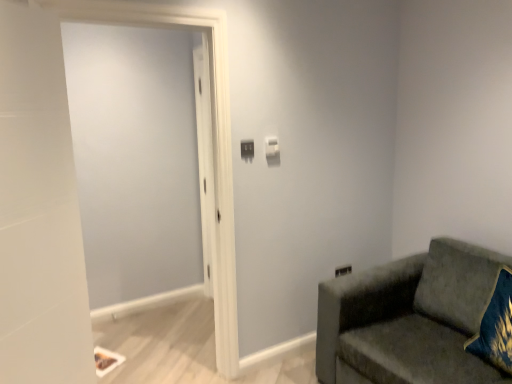
Locate an element on the screen. This screenshot has height=384, width=512. velvet green couch at right is located at coordinates (410, 317).

The height and width of the screenshot is (384, 512). What do you see at coordinates (247, 148) in the screenshot?
I see `matte plastic light switch at center, acting as the 1th light switch starting from the left` at bounding box center [247, 148].

Consider the image. What is the approximate height of velvet blue pillow at lower right?

velvet blue pillow at lower right is 21.24 inches tall.

This screenshot has height=384, width=512. Describe the element at coordinates (496, 325) in the screenshot. I see `velvet blue pillow at lower right` at that location.

Where is `velvet green couch at right`? The image size is (512, 384). velvet green couch at right is located at coordinates (410, 317).

Is white plastic light switch at upper center, the 1th light switch positioned from the back, at the back of velvet blue pillow at lower right?

No, velvet blue pillow at lower right's orientation is not away from white plastic light switch at upper center, the 1th light switch positioned from the back.

From the image's perspective, is velvet blue pillow at lower right located above or below white plastic light switch at upper center, the 2th light switch when ordered from left to right?

Clearly, from the image's perspective, velvet blue pillow at lower right is below white plastic light switch at upper center, the 2th light switch when ordered from left to right.

Looking at their sizes, would you say velvet blue pillow at lower right is wider or thinner than white plastic light switch at upper center, the 1th light switch positioned from the back?

Clearly, velvet blue pillow at lower right has more width compared to white plastic light switch at upper center, the 1th light switch positioned from the back.

Is velvet blue pillow at lower right with white plastic light switch at upper center, the 1th light switch positioned from the right?

No, velvet blue pillow at lower right is not touching white plastic light switch at upper center, the 1th light switch positioned from the right.

Considering the sizes of velvet green couch at right and velvet blue pillow at lower right in the image, is velvet green couch at right bigger or smaller than velvet blue pillow at lower right?

Considering their sizes, velvet green couch at right takes up more space than velvet blue pillow at lower right.

Is velvet green couch at right shorter than velvet blue pillow at lower right?

In fact, velvet green couch at right may be taller than velvet blue pillow at lower right.

Which is behind, velvet green couch at right or velvet blue pillow at lower right?

velvet blue pillow at lower right is further from the camera.

Is velvet green couch at right next to velvet blue pillow at lower right?

No.

Locate an element on the screen. This screenshot has width=512, height=384. light switch located behind the matte plastic light switch at center, acting as the 1th light switch starting from the left is located at coordinates (272, 147).

From a real-world perspective, is matte plastic light switch at center, which appears as the first light switch when viewed from the front, over white plastic light switch at upper center, the 2th light switch when ordered from left to right?

No, from a real-world perspective, matte plastic light switch at center, which appears as the first light switch when viewed from the front, is not above white plastic light switch at upper center, the 2th light switch when ordered from left to right.

Is matte plastic light switch at center, which ranks as the second light switch in back-to-front order, at the right side of white plastic light switch at upper center, the second light switch from the front?

No.

Considering the relative sizes of matte plastic light switch at center, acting as the 1th light switch starting from the left, and white plastic light switch at upper center, the 1th light switch positioned from the right, in the image provided, is matte plastic light switch at center, acting as the 1th light switch starting from the left, wider than white plastic light switch at upper center, the 1th light switch positioned from the right,?

In fact, matte plastic light switch at center, acting as the 1th light switch starting from the left, might be narrower than white plastic light switch at upper center, the 1th light switch positioned from the right.

Between velvet blue pillow at lower right and matte plastic light switch at center, acting as the 1th light switch starting from the left, which one has larger size?

velvet blue pillow at lower right is bigger.

How distant is velvet blue pillow at lower right from matte plastic light switch at center, arranged as the 2th light switch when viewed from the right?

1.50 meters.

From the picture: From a real-world perspective, between velvet blue pillow at lower right and matte plastic light switch at center, arranged as the 2th light switch when viewed from the right, who is vertically higher?

matte plastic light switch at center, arranged as the 2th light switch when viewed from the right.

Considering the sizes of objects velvet blue pillow at lower right and matte plastic light switch at center, arranged as the 2th light switch when viewed from the right, in the image provided, who is shorter, velvet blue pillow at lower right or matte plastic light switch at center, arranged as the 2th light switch when viewed from the right,?

matte plastic light switch at center, arranged as the 2th light switch when viewed from the right, is shorter.

Is velvet blue pillow at lower right facing away from velvet green couch at right?

Absolutely, velvet blue pillow at lower right is directed away from velvet green couch at right.

From the image's perspective, is velvet blue pillow at lower right below velvet green couch at right?

No, from the image's perspective, velvet blue pillow at lower right is not below velvet green couch at right.

Considering the relative sizes of velvet blue pillow at lower right and velvet green couch at right in the image provided, is velvet blue pillow at lower right bigger than velvet green couch at right?

No, velvet blue pillow at lower right is not bigger than velvet green couch at right.

Considering the relative sizes of matte plastic light switch at center, acting as the 1th light switch starting from the left, and velvet blue pillow at lower right in the image provided, is matte plastic light switch at center, acting as the 1th light switch starting from the left, taller than velvet blue pillow at lower right?

Incorrect, the height of matte plastic light switch at center, acting as the 1th light switch starting from the left, is not larger of that of velvet blue pillow at lower right.

Does matte plastic light switch at center, acting as the 1th light switch starting from the left, have a lesser width compared to velvet blue pillow at lower right?

Yes, matte plastic light switch at center, acting as the 1th light switch starting from the left, is thinner than velvet blue pillow at lower right.

Considering the relative positions of matte plastic light switch at center, which appears as the first light switch when viewed from the front, and velvet blue pillow at lower right in the image provided, is matte plastic light switch at center, which appears as the first light switch when viewed from the front, in front of velvet blue pillow at lower right?

No, matte plastic light switch at center, which appears as the first light switch when viewed from the front, is further to the viewer.

Is matte plastic light switch at center, which appears as the first light switch when viewed from the front, turned away from velvet blue pillow at lower right?

No, matte plastic light switch at center, which appears as the first light switch when viewed from the front, is not facing the opposite direction of velvet blue pillow at lower right.

Measure the distance between white glossy door at left and white plastic light switch at upper center, the 2th light switch when ordered from left to right.

white glossy door at left and white plastic light switch at upper center, the 2th light switch when ordered from left to right, are 24.78 inches apart.

From the image's perspective, is white glossy door at left positioned above or below white plastic light switch at upper center, the second light switch from the front?

Clearly, from the image's perspective, white glossy door at left is below white plastic light switch at upper center, the second light switch from the front.

How different are the orientations of white glossy door at left and white plastic light switch at upper center, the 1th light switch positioned from the back, in degrees?

2.01 degrees.

Which object is thinner, white glossy door at left or white plastic light switch at upper center, the 2th light switch when ordered from left to right?

Thinner between the two is white plastic light switch at upper center, the 2th light switch when ordered from left to right.

In the image, there is a white plastic light switch at upper center, the 1th light switch positioned from the right. What are the coordinates of `throw pillow below it (from a real-world perspective)` in the screenshot? It's located at (496, 325).

Find the location of a particular element. throw pillow behind the velvet green couch at right is located at coordinates (496, 325).

Estimate the real-world distances between objects in this image. Which object is closer to matte plastic light switch at center, which appears as the first light switch when viewed from the front, white plastic light switch at upper center, the 1th light switch positioned from the back, or white glossy door at left?

white plastic light switch at upper center, the 1th light switch positioned from the back, is positioned closer to the anchor matte plastic light switch at center, which appears as the first light switch when viewed from the front.

When comparing their distances from white glossy door at left, does velvet green couch at right or velvet blue pillow at lower right seem further?

The object further to white glossy door at left is velvet blue pillow at lower right.

Based on their spatial positions, is velvet green couch at right or matte plastic light switch at center, acting as the 1th light switch starting from the left, closer to velvet blue pillow at lower right?

velvet green couch at right lies closer to velvet blue pillow at lower right than the other object.

From the image, which object appears to be nearer to white plastic light switch at upper center, the 2th light switch when ordered from left to right, white glossy door at left or matte plastic light switch at center, arranged as the 2th light switch when viewed from the right?

matte plastic light switch at center, arranged as the 2th light switch when viewed from the right, is positioned closer to the anchor white plastic light switch at upper center, the 2th light switch when ordered from left to right.

Looking at the image, which one is located closer to white plastic light switch at upper center, the 1th light switch positioned from the right, velvet green couch at right or white glossy door at left?

The object closer to white plastic light switch at upper center, the 1th light switch positioned from the right, is white glossy door at left.

From the image, which object appears to be nearer to white plastic light switch at upper center, the 1th light switch positioned from the back, velvet blue pillow at lower right or velvet green couch at right?

velvet green couch at right is positioned closer to the anchor white plastic light switch at upper center, the 1th light switch positioned from the back.

Considering their positions, is white glossy door at left positioned closer to white plastic light switch at upper center, the 1th light switch positioned from the back, than velvet blue pillow at lower right?

white glossy door at left is positioned closer to the anchor white plastic light switch at upper center, the 1th light switch positioned from the back.

When comparing their distances from velvet blue pillow at lower right, does velvet green couch at right or white glossy door at left seem closer?

Among the two, velvet green couch at right is located nearer to velvet blue pillow at lower right.

This screenshot has height=384, width=512. I want to click on light switch positioned between white glossy door at left and white plastic light switch at upper center, the 1th light switch positioned from the right, from near to far, so click(x=247, y=148).

The width and height of the screenshot is (512, 384). Identify the location of light switch situated between matte plastic light switch at center, which appears as the first light switch when viewed from the front, and velvet blue pillow at lower right from left to right. (272, 147).

Where is `studio couch located between white plastic light switch at upper center, the 2th light switch when ordered from left to right, and velvet blue pillow at lower right in the left-right direction`? This screenshot has height=384, width=512. studio couch located between white plastic light switch at upper center, the 2th light switch when ordered from left to right, and velvet blue pillow at lower right in the left-right direction is located at coordinates (410, 317).

Where is `studio couch between white glossy door at left and velvet blue pillow at lower right`? The height and width of the screenshot is (384, 512). studio couch between white glossy door at left and velvet blue pillow at lower right is located at coordinates (410, 317).